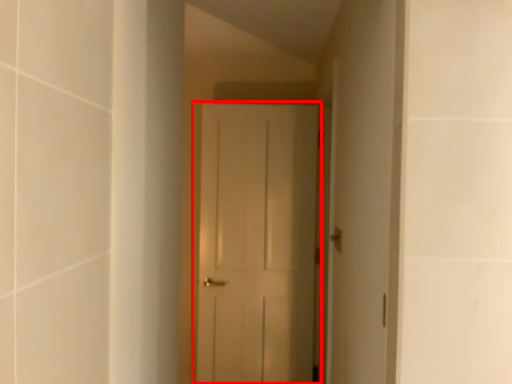
Question: Where is door (annotated by the red box) located in relation to door handle in the image?

Choices:
 (A) right
 (B) left

Answer: (B)